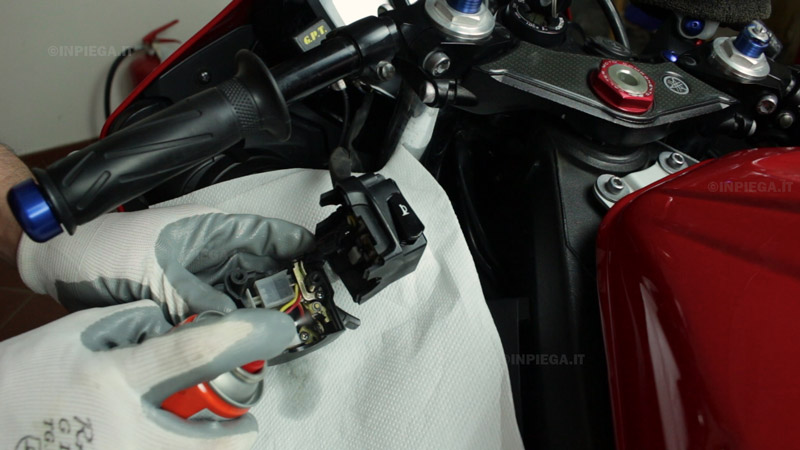
Find the location of a particular element. This screenshot has width=800, height=450. fire extinguisher is located at coordinates (145, 61).